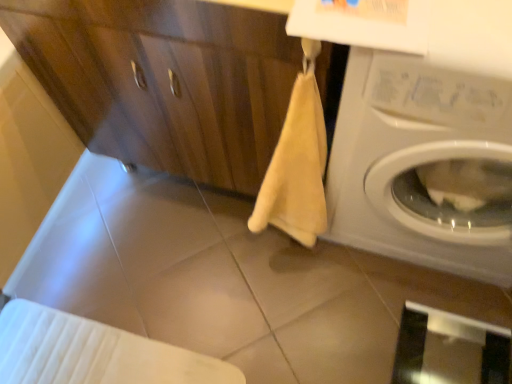
Image resolution: width=512 pixels, height=384 pixels. What are the coordinates of `unoccupied region to the right of beige matte tile at center` in the screenshot? It's located at (279, 294).